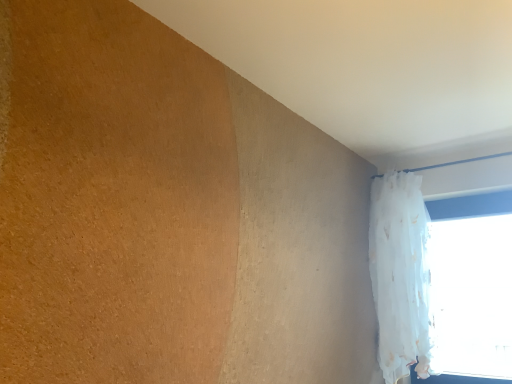
Question: In the image, is white sheer curtain at upper right positioned in front of or behind white sheer curtain at right?

Choices:
 (A) behind
 (B) front

Answer: (B)

Question: From a real-world perspective, is white sheer curtain at upper right physically located above or below white sheer curtain at right?

Choices:
 (A) above
 (B) below

Answer: (A)

Question: Is white sheer curtain at upper right bigger or smaller than white sheer curtain at right?

Choices:
 (A) small
 (B) big

Answer: (B)

Question: From their relative heights in the image, would you say white sheer curtain at right is taller or shorter than white sheer curtain at upper right?

Choices:
 (A) tall
 (B) short

Answer: (B)

Question: Is white sheer curtain at right wider or thinner than white sheer curtain at upper right?

Choices:
 (A) thin
 (B) wide

Answer: (A)

Question: In the image, is white sheer curtain at right positioned in front of or behind white sheer curtain at upper right?

Choices:
 (A) behind
 (B) front

Answer: (A)

Question: Considering the relative positions of white sheer curtain at right and white sheer curtain at upper right in the image provided, is white sheer curtain at right to the left or to the right of white sheer curtain at upper right?

Choices:
 (A) left
 (B) right

Answer: (B)